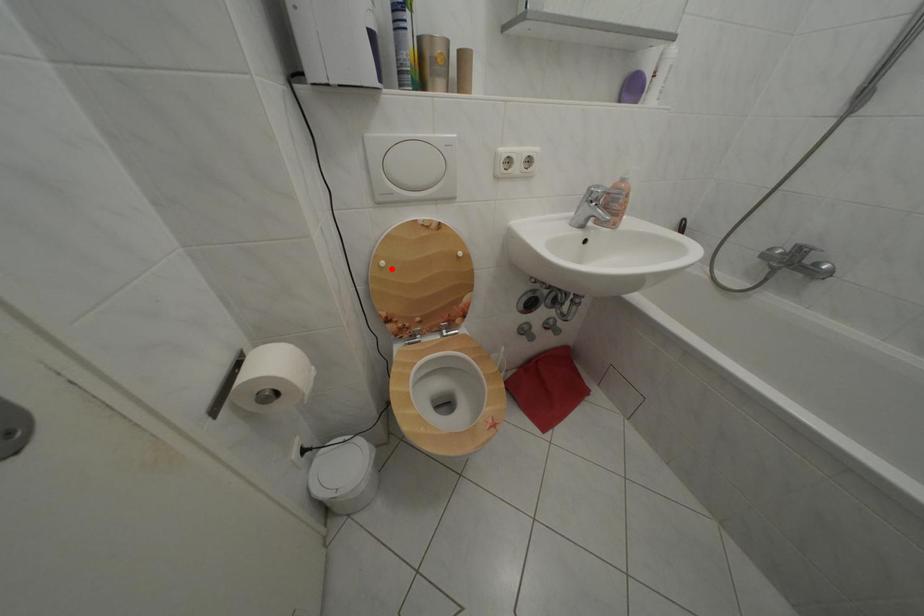
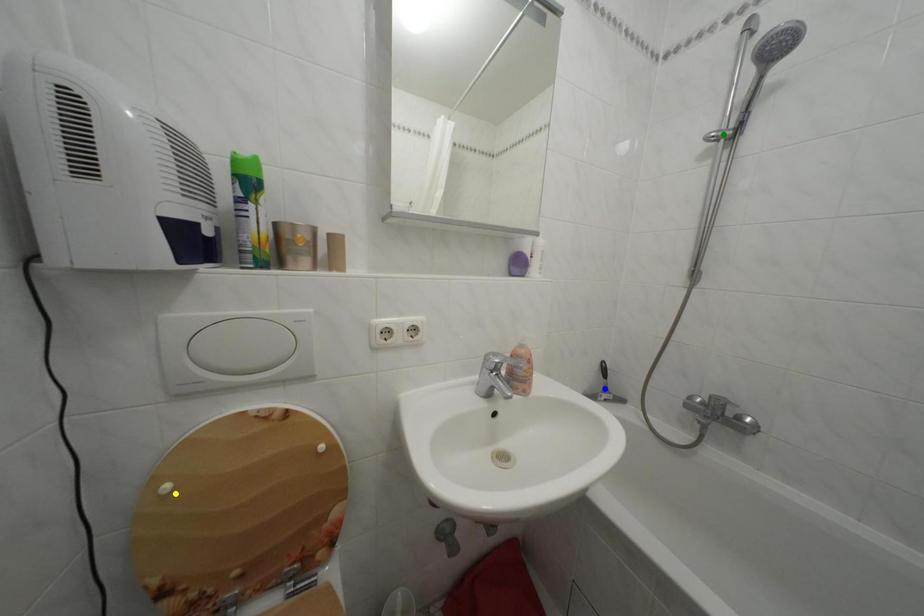
Question: I am providing you with two images of the same scene from different viewpoints. A red point is marked on the first image. You are given multiple points on the second image. Which point in image 2 represents the same 3d spot as the red point in image 1?

Choices:
 (A) yellow point
 (B) green point
 (C) blue point

Answer: (A)